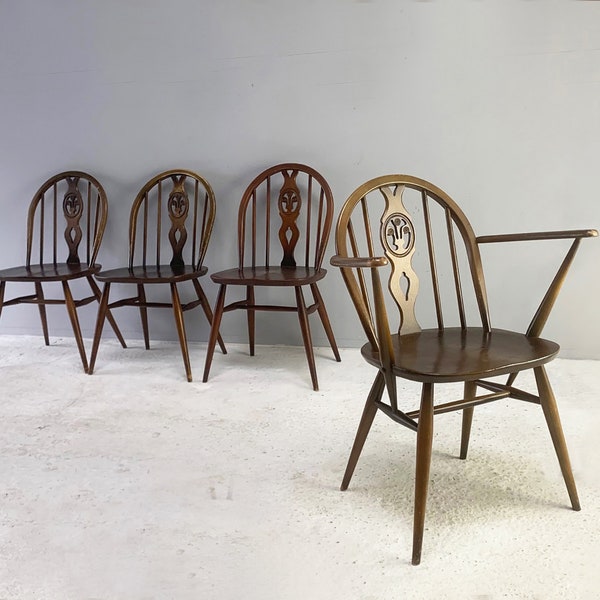
Locate an element on the screen. The height and width of the screenshot is (600, 600). wooden chair seats is located at coordinates (46, 269), (146, 269), (265, 273), (462, 346).